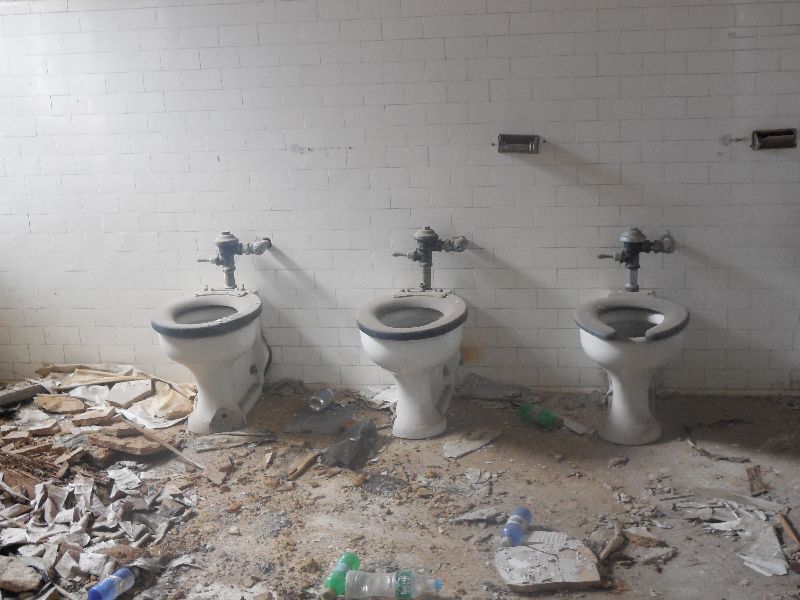
At what (x,y) coordinates should I click in order to perform the action: click on bottle. Please return your answer as a coordinate pair (x, y). Looking at the image, I should click on (382, 586).